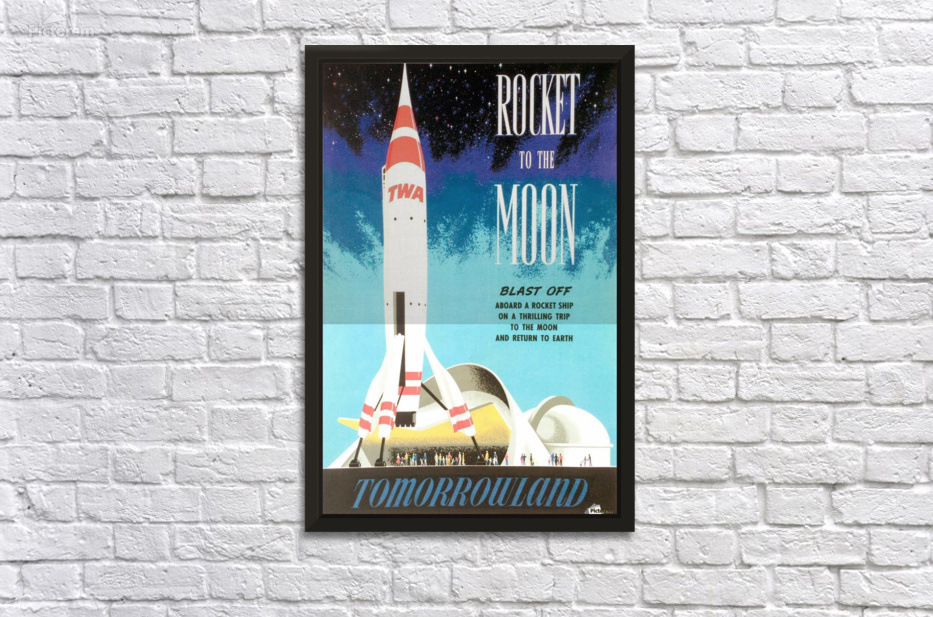
The width and height of the screenshot is (933, 617). What are the coordinates of `brick wall` in the screenshot? It's located at (744, 253).